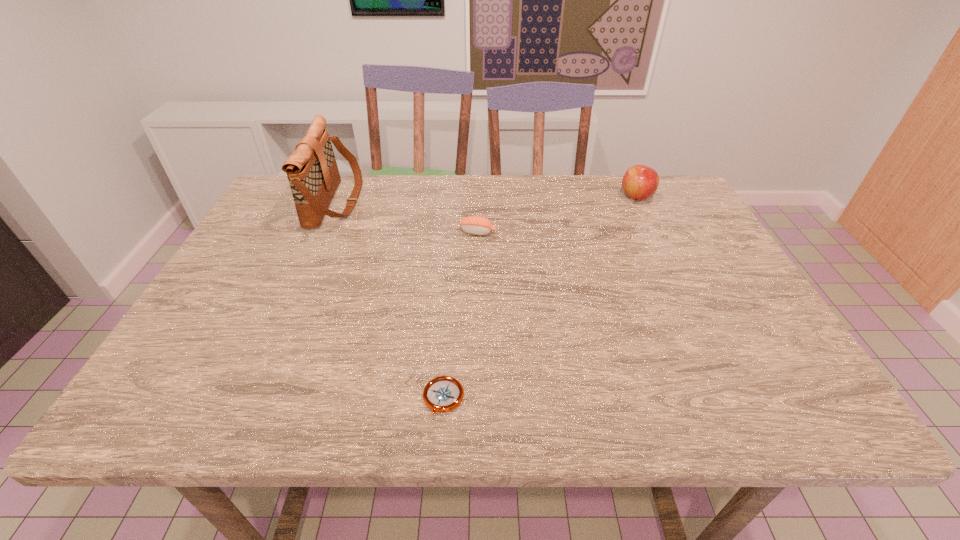
Where is `free space between the shortest object and the sushi`? free space between the shortest object and the sushi is located at coordinates (461, 315).

At what (x,y) coordinates should I click in order to perform the action: click on vacant region between the compass and the third shortest object. Please return your answer as a coordinate pair (x, y). The width and height of the screenshot is (960, 540). Looking at the image, I should click on (540, 298).

Where is `vacant space that's between the apple and the sushi`? vacant space that's between the apple and the sushi is located at coordinates (557, 214).

Where is `vacant area that lies between the third tallest object and the compass`? The height and width of the screenshot is (540, 960). vacant area that lies between the third tallest object and the compass is located at coordinates (461, 315).

Identify the location of empty space between the sushi and the apple. This screenshot has width=960, height=540. (557, 214).

The width and height of the screenshot is (960, 540). What are the coordinates of `object that is the closest one to the shoulder bag` in the screenshot? It's located at (478, 225).

Identify which object is the nearest to the shoulder bag. Please provide its 2D coordinates. Your answer should be formatted as a tuple, i.e. [(x, y)], where the tuple contains the x and y coordinates of a point satisfying the conditions above.

[(478, 225)]

This screenshot has width=960, height=540. Find the location of `vacant space that satisfies the following two spatial constraints: 1. on the front-facing side of the leftmost object; 2. on the right side of the sushi`. vacant space that satisfies the following two spatial constraints: 1. on the front-facing side of the leftmost object; 2. on the right side of the sushi is located at coordinates (323, 232).

Where is `vacant point that satisfies the following two spatial constraints: 1. on the front-facing side of the leftmost object; 2. on the left side of the sushi`? This screenshot has height=540, width=960. vacant point that satisfies the following two spatial constraints: 1. on the front-facing side of the leftmost object; 2. on the left side of the sushi is located at coordinates (323, 232).

This screenshot has height=540, width=960. I want to click on vacant area in the image that satisfies the following two spatial constraints: 1. on the front-facing side of the leftmost object; 2. on the left side of the shortest object, so click(249, 399).